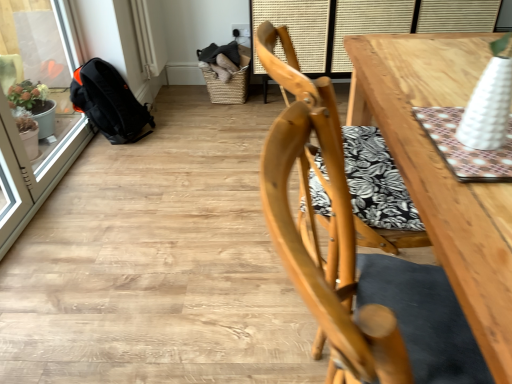
Question: Considering the relative positions of woven brown basket at upper center and light wood chair at center in the image provided, is woven brown basket at upper center to the left of light wood chair at center from the viewer's perspective?

Choices:
 (A) no
 (B) yes

Answer: (B)

Question: Can we say woven brown basket at upper center lies outside light wood chair at center?

Choices:
 (A) yes
 (B) no

Answer: (A)

Question: Is woven brown basket at upper center at the right side of light wood chair at center?

Choices:
 (A) yes
 (B) no

Answer: (B)

Question: Is woven brown basket at upper center facing away from light wood chair at center?

Choices:
 (A) yes
 (B) no

Answer: (B)

Question: From a real-world perspective, is woven brown basket at upper center beneath light wood chair at center?

Choices:
 (A) yes
 (B) no

Answer: (A)

Question: Is black fabric backpack at left situated inside transparent glass screen door at left or outside?

Choices:
 (A) inside
 (B) outside

Answer: (B)

Question: In terms of height, does black fabric backpack at left look taller or shorter compared to transparent glass screen door at left?

Choices:
 (A) tall
 (B) short

Answer: (B)

Question: From the image's perspective, relative to transparent glass screen door at left, is black fabric backpack at left above or below?

Choices:
 (A) above
 (B) below

Answer: (A)

Question: From a real-world perspective, relative to transparent glass screen door at left, is black fabric backpack at left vertically above or below?

Choices:
 (A) below
 (B) above

Answer: (A)

Question: Considering the positions of point (204, 67) and point (486, 21), is point (204, 67) closer or farther from the camera than point (486, 21)?

Choices:
 (A) farther
 (B) closer

Answer: (A)

Question: Would you say woven brown basket at upper center is to the left or to the right of wooden table at upper right in the picture?

Choices:
 (A) left
 (B) right

Answer: (A)

Question: Is woven brown basket at upper center taller or shorter than wooden table at upper right?

Choices:
 (A) short
 (B) tall

Answer: (A)

Question: Is woven brown basket at upper center inside or outside of wooden table at upper right?

Choices:
 (A) outside
 (B) inside

Answer: (A)

Question: In terms of size, does black fabric backpack at left appear bigger or smaller than woven brown basket at upper center?

Choices:
 (A) big
 (B) small

Answer: (A)

Question: Is black fabric backpack at left in front of or behind woven brown basket at upper center in the image?

Choices:
 (A) front
 (B) behind

Answer: (A)